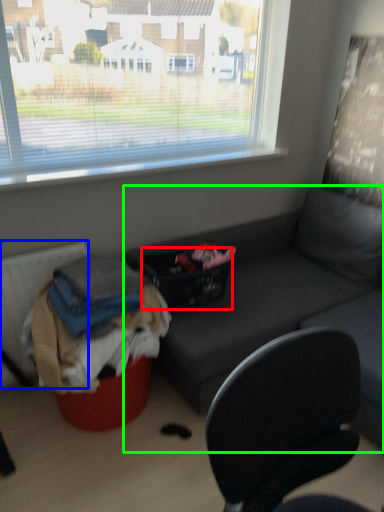
Question: Which object is the closest to the basket (highlighted by a red box)? Choose among these: radiator (highlighted by a blue box) or studio couch (highlighted by a green box).

Choices:
 (A) radiator
 (B) studio couch

Answer: (B)